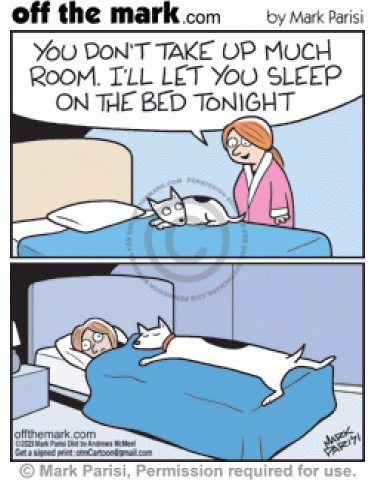
This screenshot has height=480, width=380. Find the location of `blue cartoon bedsheet`. blue cartoon bedsheet is located at coordinates (153, 397), (114, 244).